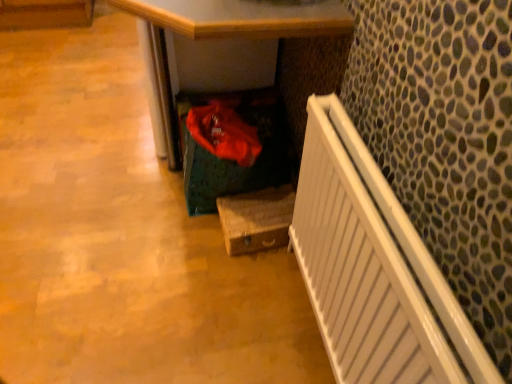
Question: From the image's perspective, is wooden box at lower center located above or below white glossy radiator at right?

Choices:
 (A) above
 (B) below

Answer: (A)

Question: Considering the positions of wooden box at lower center and white glossy radiator at right in the image, is wooden box at lower center wider or thinner than white glossy radiator at right?

Choices:
 (A) wide
 (B) thin

Answer: (A)

Question: Which is nearer to the wooden box at lower center?

Choices:
 (A) white glossy radiator at right
 (B) wooden at lower center

Answer: (B)

Question: Estimate the real-world distances between objects in this image. Which object is closer to the wooden box at lower center?

Choices:
 (A) wooden at lower center
 (B) white glossy radiator at right

Answer: (A)